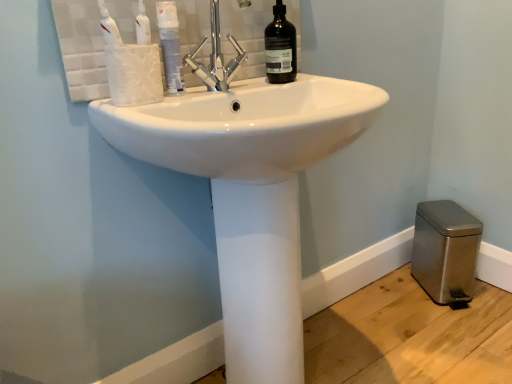
Question: From their relative heights in the image, would you say chrome metallic faucet at upper center is taller or shorter than white glossy mouthwash at upper center?

Choices:
 (A) tall
 (B) short

Answer: (A)

Question: From a real-world perspective, is chrome metallic faucet at upper center positioned above or below white glossy mouthwash at upper center?

Choices:
 (A) below
 (B) above

Answer: (B)

Question: Based on their relative distances, which object is farther from the white glossy mouthwash at upper center?

Choices:
 (A) chrome metallic faucet at upper center
 (B) white glossy sink at center
 (C) black glass bottle at upper center

Answer: (B)

Question: Which is farther from the black glass bottle at upper center?

Choices:
 (A) white glossy sink at center
 (B) white glossy mouthwash at upper center
 (C) chrome metallic faucet at upper center

Answer: (A)